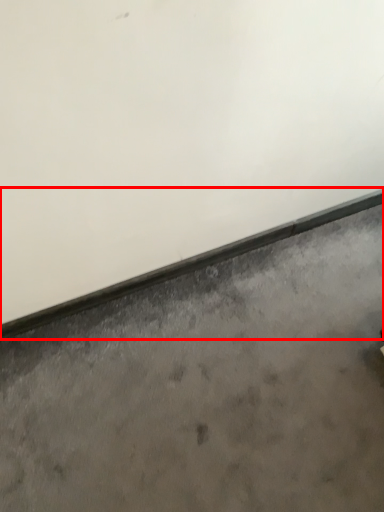
Question: Where is window sill (annotated by the red box) located in relation to concrete in the image?

Choices:
 (A) left
 (B) right

Answer: (A)